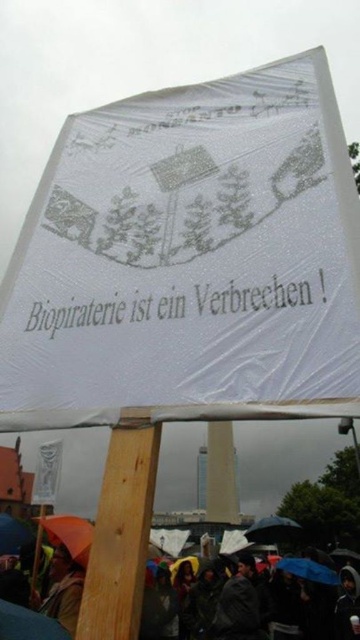
You are a photographer trying to capture a clear shot of the banner in the protest scene. You notice two umbrellas near the front, a transparent plastic umbrella at lower center and a blue fabric umbrella at lower center. Which umbrella should you move to avoid blocking the view of the banner?

The transparent plastic umbrella at lower center is positioned on the right side of the blue fabric umbrella at lower center. To avoid blocking the banner, you should move the transparent plastic umbrella at lower center to the left or the blue fabric umbrella at lower center to the right.

You are a photographer trying to capture the protest scene. You notice a point at coordinates point [33,624]. What object or feature is located at this point?

The point [33,624] corresponds to raincoats at lower center.

You are a photographer trying to capture the protest scene. You notice the raincoats at lower center and the blue fabric umbrella at lower center. Which object is located to the left of the other?

The raincoats at lower center is positioned on the left side of blue fabric umbrella at lower center.